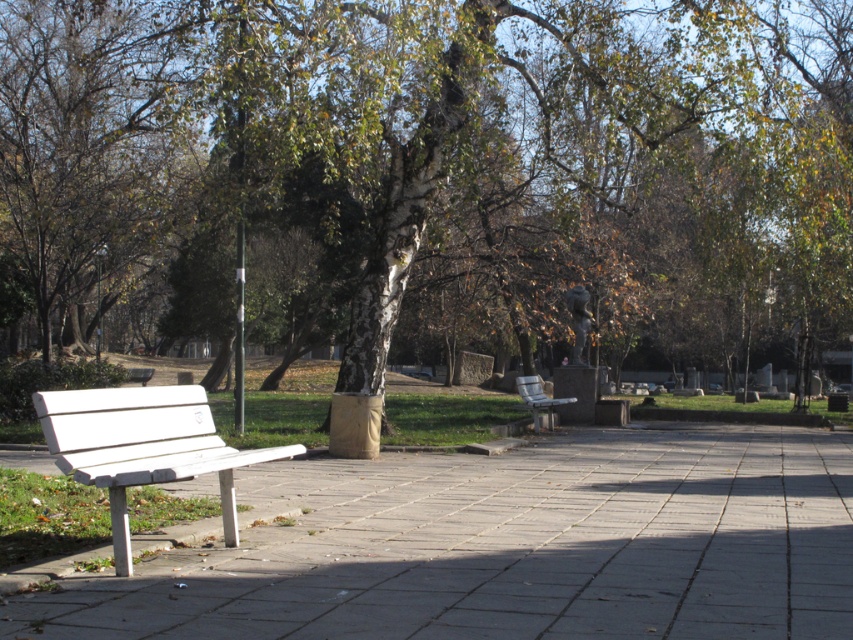
Is white plastic bench at lower left wider than wooden bench at center?

Correct, the width of white plastic bench at lower left exceeds that of wooden bench at center.

Between white plastic bench at lower left and wooden bench at center, which one is positioned higher?

white plastic bench at lower left is higher up.

Between point (129, 403) and point (548, 413), which one is positioned in front?

Point (129, 403)

What are the coordinates of `white plastic bench at lower left` in the screenshot? It's located at coord(142,445).

Between white concrete pavement at center and white plastic bench at lower left, which one has more height?

Standing taller between the two is white plastic bench at lower left.

Is white concrete pavement at center smaller than white plastic bench at lower left?

Actually, white concrete pavement at center might be larger than white plastic bench at lower left.

Who is more forward, (370, 529) or (74, 467)?

Positioned in front is point (74, 467).

I want to click on white concrete pavement at center, so (x=509, y=547).

Can you confirm if white concrete pavement at center is bigger than wooden bench at center?

Indeed, white concrete pavement at center has a larger size compared to wooden bench at center.

Is the position of white concrete pavement at center less distant than that of wooden bench at center?

That is True.

What do you see at coordinates (509, 547) in the screenshot?
I see `white concrete pavement at center` at bounding box center [509, 547].

At what (x,y) coordinates should I click in order to perform the action: click on white concrete pavement at center. Please return your answer as a coordinate pair (x, y). Looking at the image, I should click on (509, 547).